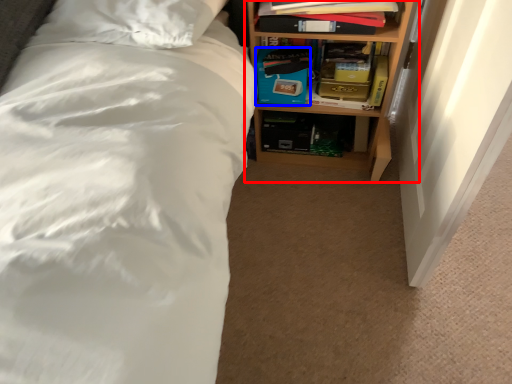
Question: Which of the following is the closest to the observer, shelf (highlighted by a red box) or box (highlighted by a blue box)?

Choices:
 (A) shelf
 (B) box

Answer: (A)